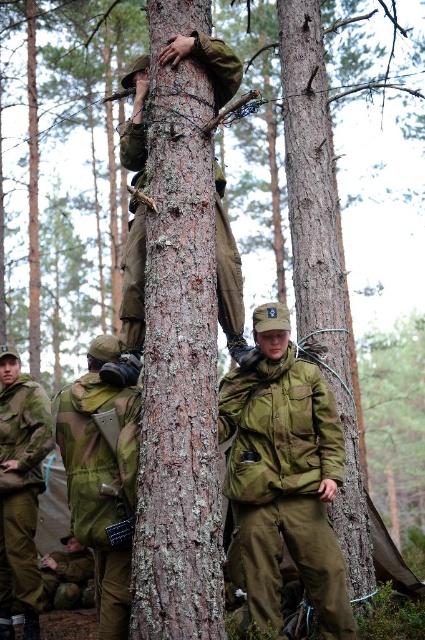
You are a photographer setting up a tripod to capture the scene. The matte green uniform at center and the camouflage fabric backpack at center are both in your frame. Which object should you focus on first if you want to ensure both are in focus, considering their heights?

The matte green uniform at center is taller than the camouflage fabric backpack at center, so focusing on the taller matte green uniform at center first will help ensure both are in focus as it occupies more of the frame.

You are a member of the military unit in the forest. You need to retrieve your radio from the matte green uniform at center. Can you reach it without moving the camouflage fabric backpack at center?

The camouflage fabric backpack at center is behind the matte green uniform at center, so you can reach the radio on the matte green uniform at center without needing to move the backpack.